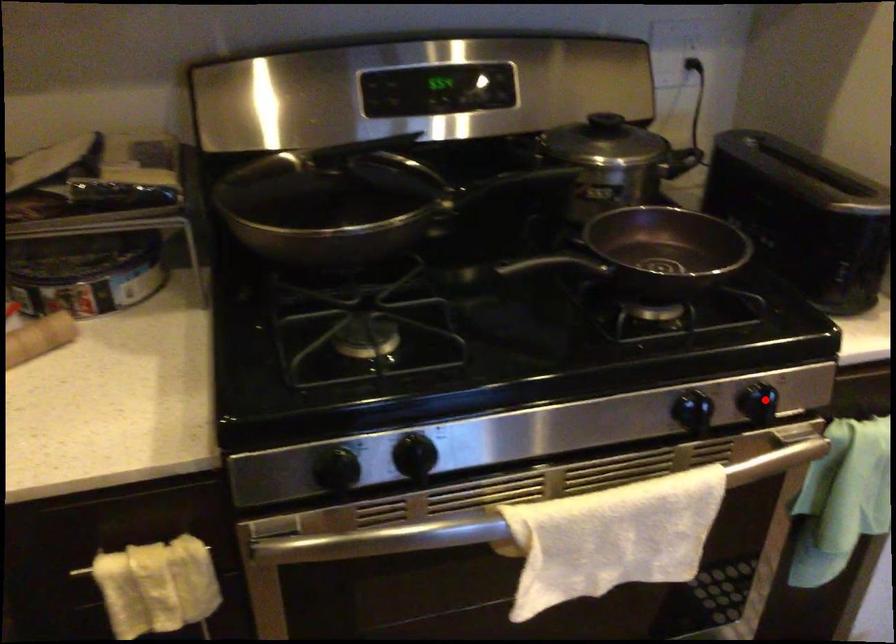
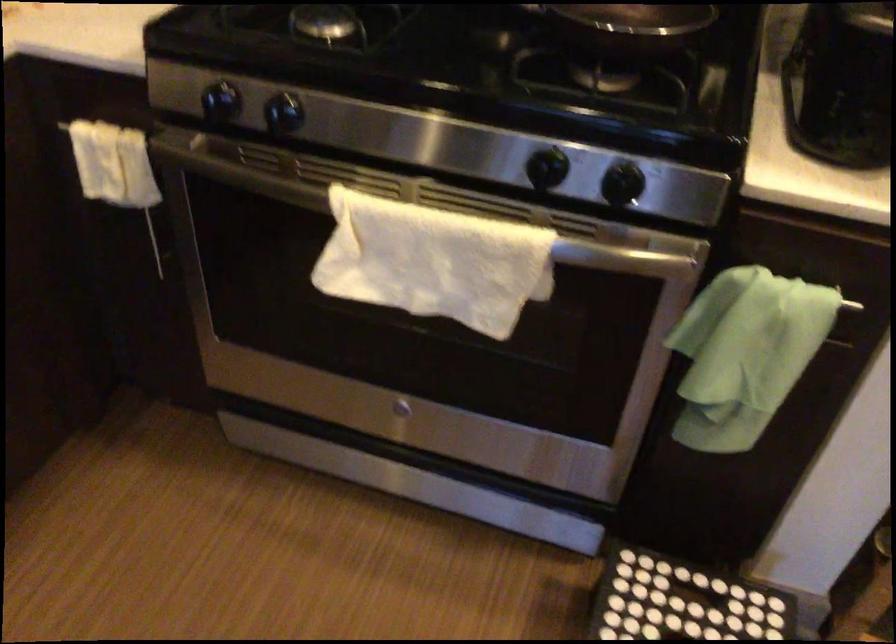
Where in the second image is the point corresponding to the highlighted location from the first image?

(623, 183)